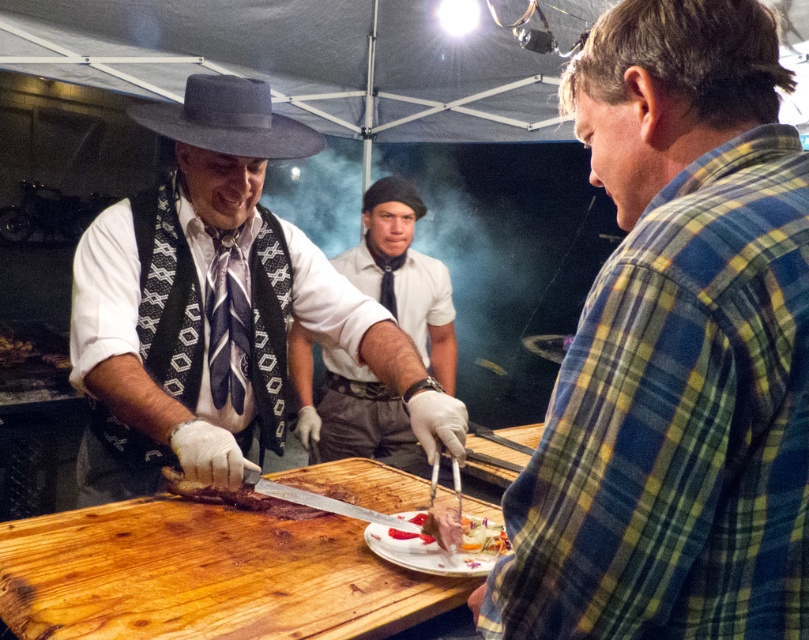
Which of these two, brown wooden table at center or white shirt at center, stands shorter?

brown wooden table at center is shorter.

Does point (352, 579) lie behind point (367, 257)?

No.

I want to click on brown wooden table at center, so click(x=206, y=573).

Does plaid flannel shirt at right appear over brown wooden table at center?

Indeed, plaid flannel shirt at right is positioned over brown wooden table at center.

Is point (799, 323) positioned in front of point (41, 540)?

Yes, point (799, 323) is in front of point (41, 540).

Identify the location of plaid flannel shirt at right. The height and width of the screenshot is (640, 809). (676, 352).

Measure the distance between matte black vest at center and smooth white cheese at center.

They are 48.98 centimeters apart.

Does matte black vest at center appear on the right side of smooth white cheese at center?

In fact, matte black vest at center is to the left of smooth white cheese at center.

Locate an element on the screen. Image resolution: width=809 pixels, height=640 pixels. matte black vest at center is located at coordinates (215, 305).